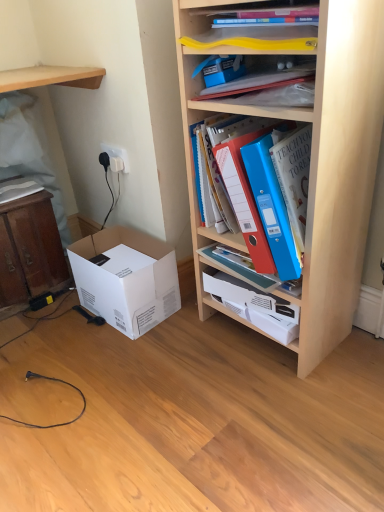
Question: From the image's perspective, is blue plastic binder at upper center, which is counted as the 1th book, starting from the right, positioned above or below white plastic electric outlet at upper left?

Choices:
 (A) above
 (B) below

Answer: (B)

Question: Does point (306, 181) appear closer or farther from the camera than point (127, 163)?

Choices:
 (A) farther
 (B) closer

Answer: (B)

Question: Which object is the farthest from the wooden cabinet at left?

Choices:
 (A) blue plastic folder at upper center
 (B) blue plastic binder at upper center, the third book in the left-to-right sequence
 (C) wooden bookshelf at upper right, which is the 2th shelf from left to right
 (D) blue plastic folder at upper center, which is counted as the second book, starting from the right
 (E) blue plastic folders at center

Answer: (B)

Question: Which is nearer to the white paper at left, which is the first book from left to right?

Choices:
 (A) blue plastic folder at upper center, which is counted as the second book, starting from the right
 (B) wooden shelf at upper left, positioned as the 1th shelf in left-to-right order
 (C) wooden cabinet at left
 (D) white cardboard box at lower left
 (E) wooden bookshelf at upper right, the first shelf in the right-to-left sequence

Answer: (C)